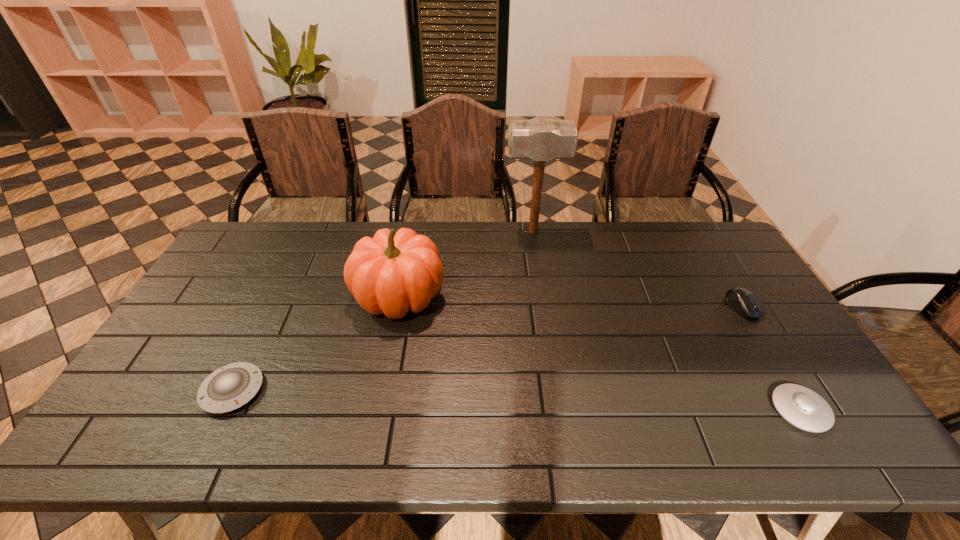
This screenshot has width=960, height=540. In order to click on vacant region located 0.160m on the front of the second object from left to right in this screenshot , I will do `click(383, 376)`.

I want to click on blank area located on the back of the mouse, so click(689, 222).

The width and height of the screenshot is (960, 540). What are the coordinates of `free point located on the left of the right saucer` in the screenshot? It's located at pyautogui.click(x=699, y=410).

Where is `free spot located on the back of the left saucer`? Image resolution: width=960 pixels, height=540 pixels. free spot located on the back of the left saucer is located at coordinates (283, 286).

In order to click on object that is at the far edge in this screenshot , I will do `click(541, 140)`.

Find the location of a particular element. object that is at the near edge is located at coordinates (800, 406).

The width and height of the screenshot is (960, 540). What are the coordinates of `mouse positioned at the right edge` in the screenshot? It's located at (744, 302).

What are the coordinates of `saucer present at the right edge` in the screenshot? It's located at (800, 406).

This screenshot has width=960, height=540. What are the coordinates of `object that is at the near right corner` in the screenshot? It's located at (800, 406).

At what (x,y) coordinates should I click in order to perform the action: click on free space at the far edge of the desktop. Please return your answer as a coordinate pair (x, y). Looking at the image, I should click on (474, 222).